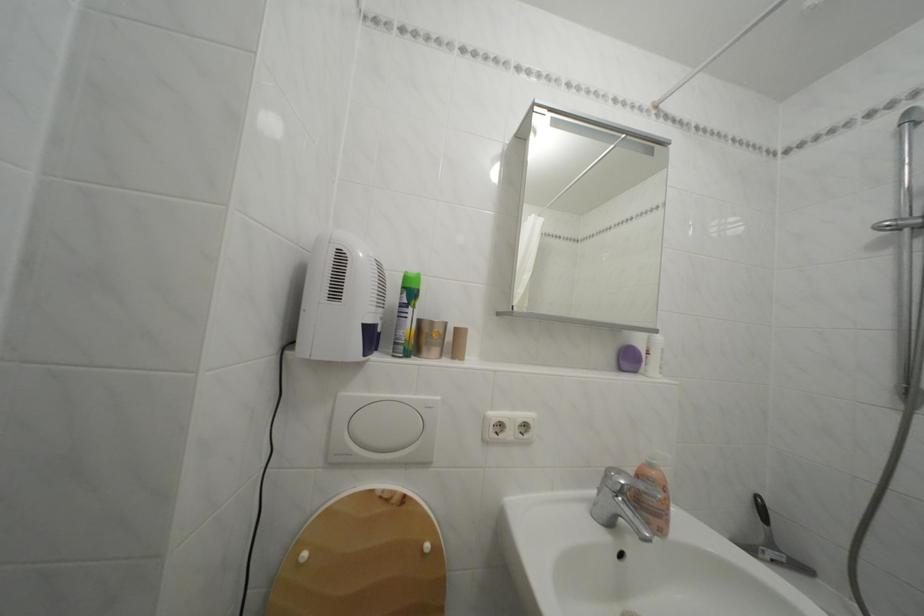
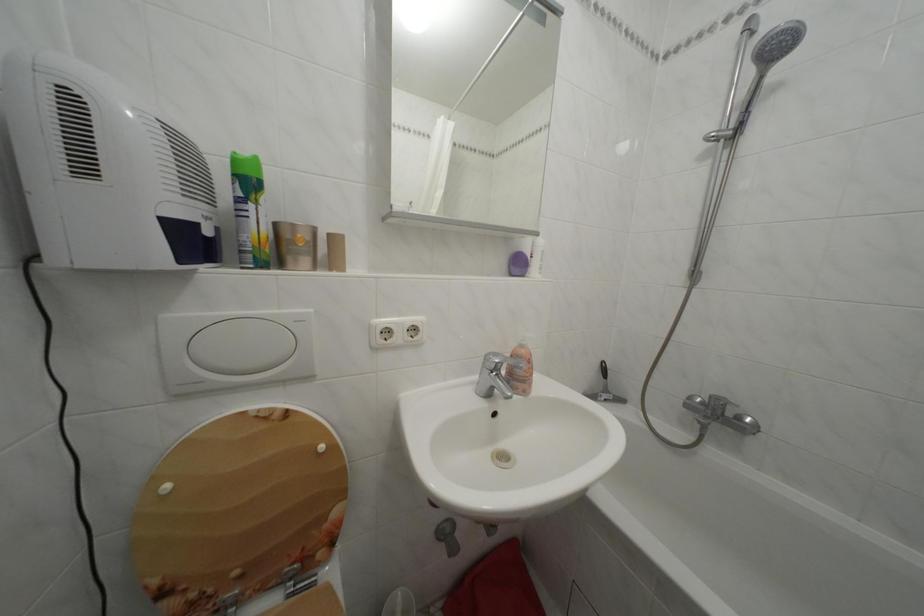
The point at (616, 477) is marked in the first image. Where is the corresponding point in the second image?

(495, 362)